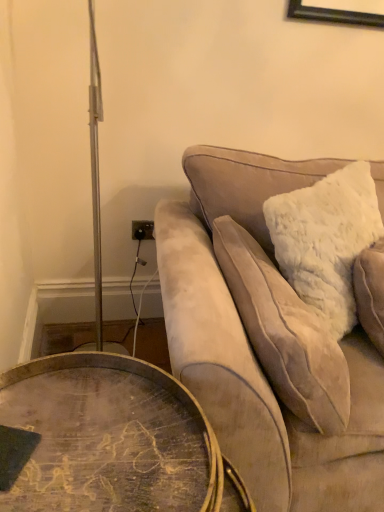
Question: Is wooden round table at lower left further to the viewer compared to velvet beige couch at upper right?

Choices:
 (A) yes
 (B) no

Answer: (B)

Question: From a real-world perspective, is wooden round table at lower left located higher than velvet beige couch at upper right?

Choices:
 (A) yes
 (B) no

Answer: (B)

Question: Can you confirm if wooden round table at lower left is taller than velvet beige couch at upper right?

Choices:
 (A) no
 (B) yes

Answer: (A)

Question: Is wooden round table at lower left shorter than velvet beige couch at upper right?

Choices:
 (A) yes
 (B) no

Answer: (A)

Question: Is velvet beige couch at upper right a part of wooden round table at lower left?

Choices:
 (A) no
 (B) yes

Answer: (A)

Question: Considering the positions of velvet beige couch at upper right and wooden round table at lower left in the image, is velvet beige couch at upper right bigger or smaller than wooden round table at lower left?

Choices:
 (A) small
 (B) big

Answer: (B)

Question: In the image, is velvet beige couch at upper right positioned in front of or behind wooden round table at lower left?

Choices:
 (A) behind
 (B) front

Answer: (A)

Question: From the image's perspective, is velvet beige couch at upper right above or below wooden round table at lower left?

Choices:
 (A) below
 (B) above

Answer: (B)

Question: Considering the positions of velvet beige couch at upper right and wooden round table at lower left in the image, is velvet beige couch at upper right wider or thinner than wooden round table at lower left?

Choices:
 (A) thin
 (B) wide

Answer: (B)

Question: Is white fluffy pillow at right situated inside wooden round table at lower left or outside?

Choices:
 (A) outside
 (B) inside

Answer: (A)

Question: Based on their positions, is white fluffy pillow at right located to the left or right of wooden round table at lower left?

Choices:
 (A) left
 (B) right

Answer: (B)

Question: From the image's perspective, is white fluffy pillow at right positioned above or below wooden round table at lower left?

Choices:
 (A) below
 (B) above

Answer: (B)

Question: Considering the positions of point (321, 323) and point (66, 387), is point (321, 323) closer or farther from the camera than point (66, 387)?

Choices:
 (A) closer
 (B) farther

Answer: (B)

Question: In terms of height, does velvet beige couch at upper right look taller or shorter compared to white fluffy pillow at right?

Choices:
 (A) tall
 (B) short

Answer: (A)

Question: Looking at the image, does velvet beige couch at upper right seem bigger or smaller compared to white fluffy pillow at right?

Choices:
 (A) big
 (B) small

Answer: (A)